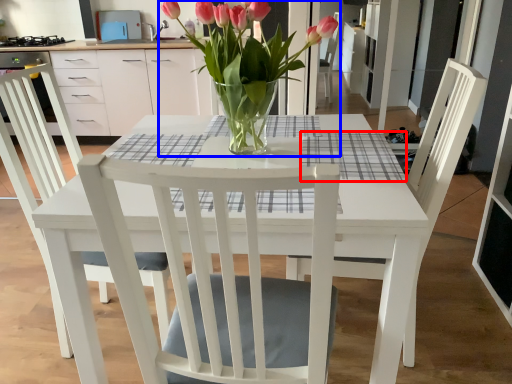
Question: Which of the following is the closest to the observer, plaid (highlighted by a red box) or houseplant (highlighted by a blue box)?

Choices:
 (A) plaid
 (B) houseplant

Answer: (B)